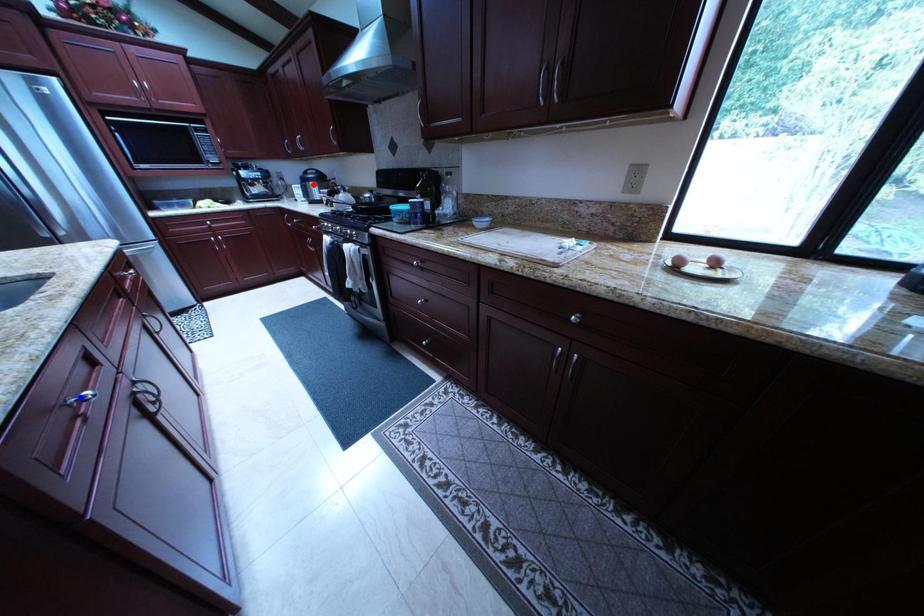
Question: Which of the two points in the image is closer to the camera?

Choices:
 (A) Blue point is closer.
 (B) Red point is closer.

Answer: (A)